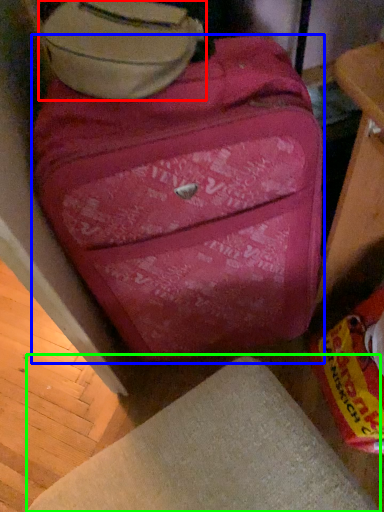
Question: Which object is the farthest from luggage (highlighted by a red box)? Choose among these: suitcase (highlighted by a blue box) or furniture (highlighted by a green box).

Choices:
 (A) suitcase
 (B) furniture

Answer: (B)